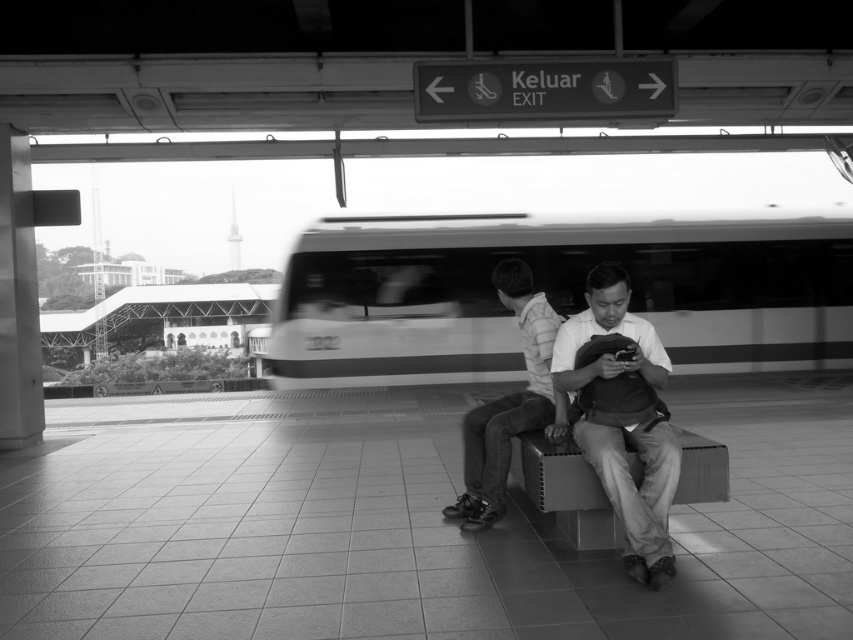
This screenshot has height=640, width=853. Describe the element at coordinates (555, 292) in the screenshot. I see `smooth white train at center` at that location.

Is point (312, 234) closer to camera compared to point (468, 452)?

No.

Is point (572, 230) farther from camera compared to point (494, 284)?

Yes, it is.

Where is `smooth white train at center`? The image size is (853, 640). smooth white train at center is located at coordinates (555, 292).

Does smooth fabric shirt at center appear on the right side of metallic gray bench at center?

Incorrect, smooth fabric shirt at center is not on the right side of metallic gray bench at center.

Is point (514, 310) positioned behind point (618, 516)?

Yes.

You are a GUI agent. You are given a task and a screenshot of the screen. Output one action in this format:
    pyautogui.click(x=<x>, y=<y>)
    Task: Click on the smooth fabric shirt at center
    Image resolution: width=853 pixels, height=640 pixels.
    Given the screenshot: What is the action you would take?
    pyautogui.click(x=636, y=488)

From the picture: Between smooth white train at center and smooth fabric shirt at center, which one is positioned lower?

smooth fabric shirt at center is lower down.

Is smooth white train at center further to camera compared to smooth fabric shirt at center?

Yes, smooth white train at center is further from the viewer.

Describe the element at coordinates (555, 292) in the screenshot. I see `smooth white train at center` at that location.

Locate an element on the screen. This screenshot has height=640, width=853. smooth white train at center is located at coordinates (555, 292).